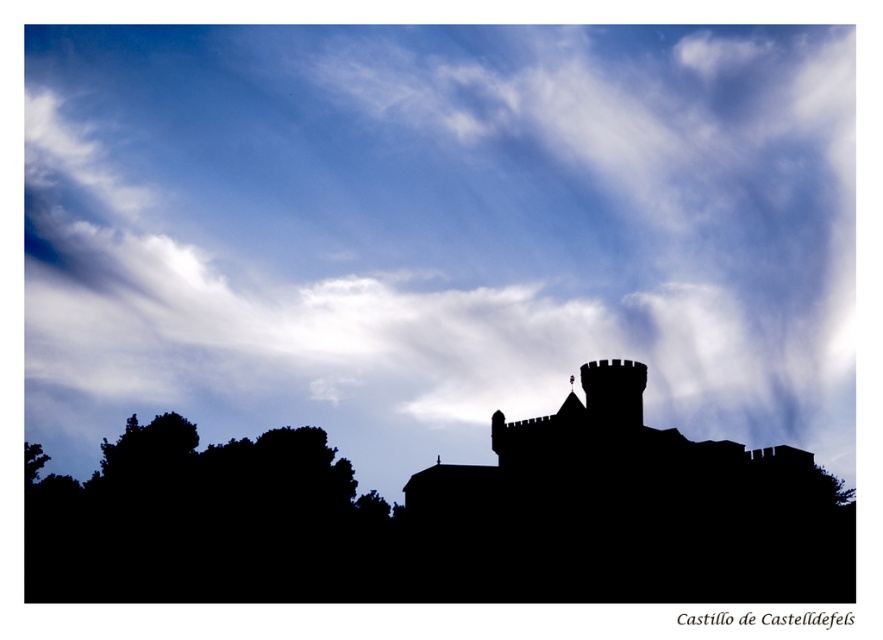
From the picture: You are an architect analyzing the layout of the scene. Given that the silhouette stone castle at center and the black leafy tree at lower left are both visible in the image, which object occupies more horizontal space in the composition?

The black leafy tree at lower left occupies more horizontal space in the composition since the silhouette stone castle at center has a lesser width compared to it.

You are an architect analyzing the placement of the silhouette stone castle at center in the image. What are the coordinates of its position in the image?

The silhouette stone castle at center is located at coordinates point (625, 513).

You are standing at the base of the black leafy tree at lower left and want to throw a stone to reach the white fluffy cloud at upper center. Considering the maximum throwing distance of a stone is 25 meters, will you be able to hit the cloud?

The distance between the white fluffy cloud at upper center and the black leafy tree at lower left is 31.53 meters. Since the maximum throwing distance is 25 meters, you cannot reach the cloud.